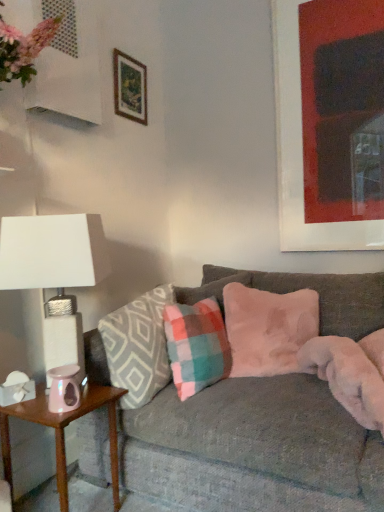
Question: From a real-world perspective, is fuzzy pink pillow at center, arranged as the third pillow when viewed from the left, physically located above or below plaid fabric pillow at center, which is the second pillow in left-to-right order?

Choices:
 (A) above
 (B) below

Answer: (A)

Question: From the image's perspective, is fuzzy pink pillow at center, arranged as the third pillow when viewed from the left, positioned above or below plaid fabric pillow at center, acting as the second pillow starting from the right?

Choices:
 (A) above
 (B) below

Answer: (A)

Question: Which of these objects is positioned closest to the pink glossy side table at lower left?

Choices:
 (A) plaid fabric pillow at center, positioned as the 3th pillow in right-to-left order
 (B) white textured lampshade at left
 (C) matte black picture frame at upper right, the second picture frame from the left
 (D) plaid fabric pillow at center, which is the second pillow in left-to-right order
 (E) velvet gray couch at center

Answer: (A)

Question: Which object is positioned farthest from the matte black picture frame at upper right, which appears as the first picture frame when viewed from the right?

Choices:
 (A) plaid fabric pillow at center, positioned as the 3th pillow in right-to-left order
 (B) velvet gray couch at center
 (C) fuzzy pink pillow at center, the 1th pillow from the right
 (D) white textured lampshade at left
 (E) pink glossy side table at lower left

Answer: (E)